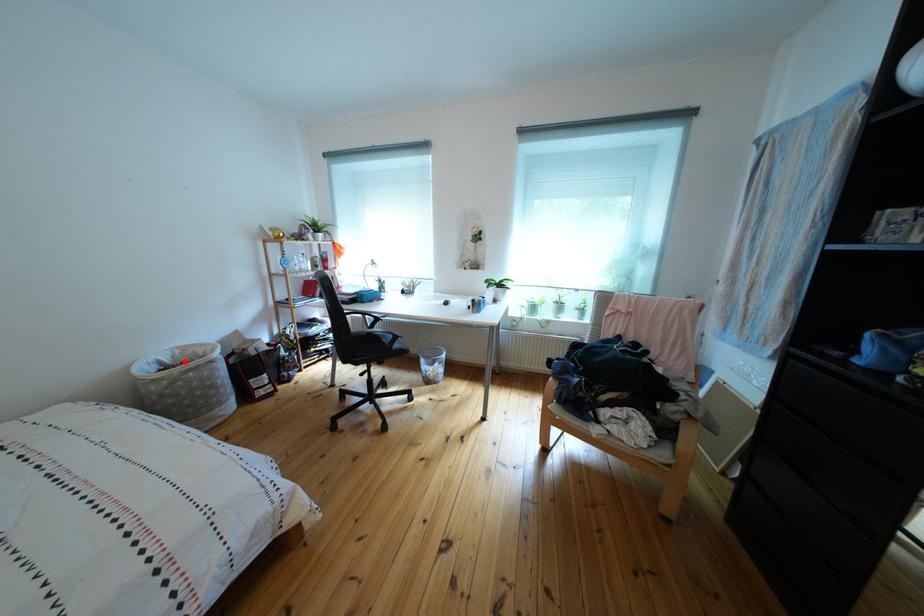
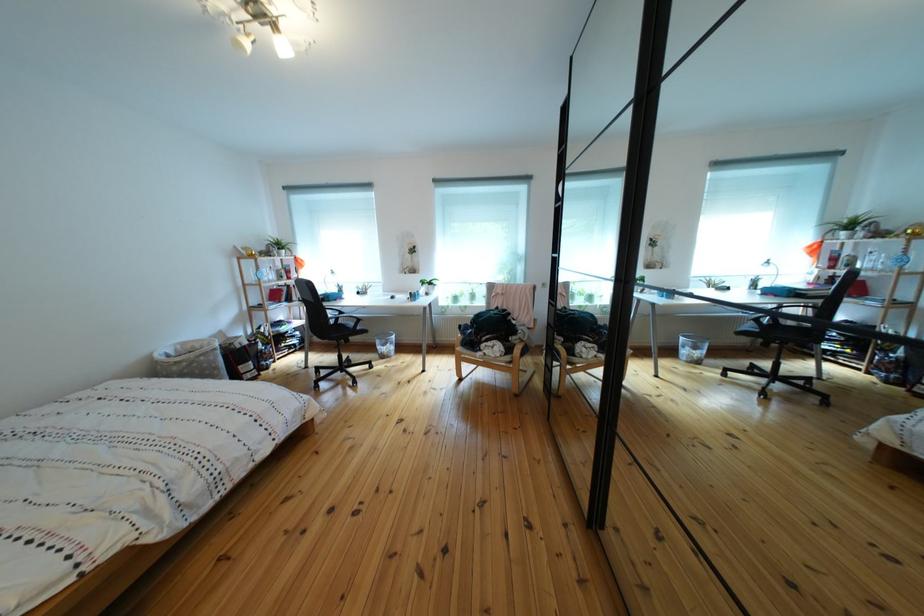
The point at the highlighted location is marked in the first image. Where is the corresponding point in the second image?

(187, 355)